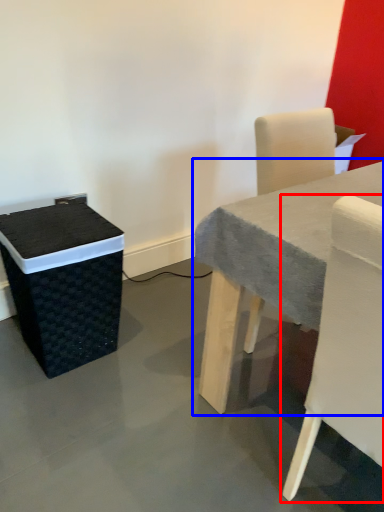
Question: Which object appears closest to the camera in this image, chair (highlighted by a red box) or table (highlighted by a blue box)?

Choices:
 (A) chair
 (B) table

Answer: (A)